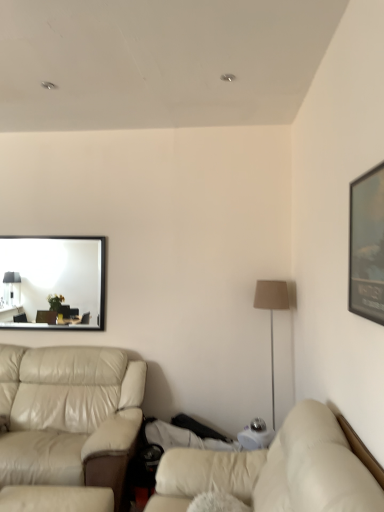
Question: In terms of size, does beige fabric floor lamp at right appear bigger or smaller than beige leather studio couch at left, acting as the first studio couch starting from the left?

Choices:
 (A) big
 (B) small

Answer: (B)

Question: From the image's perspective, relative to beige leather studio couch at left, the 2th studio couch in the right-to-left sequence, is beige fabric floor lamp at right above or below?

Choices:
 (A) below
 (B) above

Answer: (B)

Question: Which object is the farthest from the beige fabric floor lamp at right?

Choices:
 (A) matte black mirror at upper left
 (B) beige leather couch at lower right, which is the second studio couch from back to front
 (C) matte black picture frame at upper right
 (D) beige leather studio couch at left, acting as the first studio couch starting from the left

Answer: (A)

Question: Estimate the real-world distances between objects in this image. Which object is closer to the beige leather studio couch at left, arranged as the second studio couch when viewed from the front?

Choices:
 (A) matte black mirror at upper left
 (B) matte black picture frame at upper right
 (C) beige fabric floor lamp at right
 (D) beige leather couch at lower right, which is the second studio couch from back to front

Answer: (D)